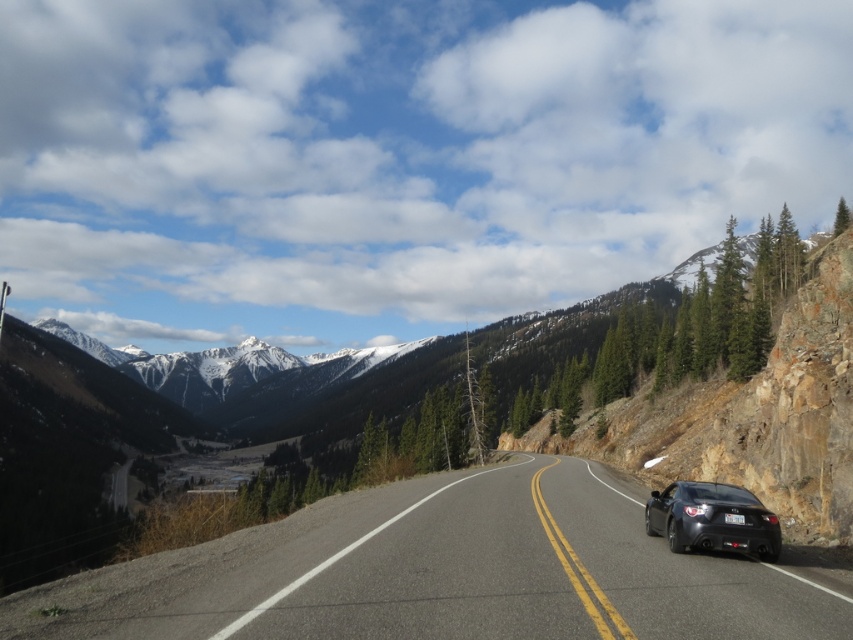
Locate an element on the screen. The width and height of the screenshot is (853, 640). black asphalt road at center is located at coordinates pyautogui.click(x=445, y=572).

Is black asphalt road at center further to camera compared to glossy black car at center?

No, it is in front of glossy black car at center.

Measure the distance between black asphalt road at center and camera.

They are 26.85 feet apart.

This screenshot has height=640, width=853. I want to click on black asphalt road at center, so click(445, 572).